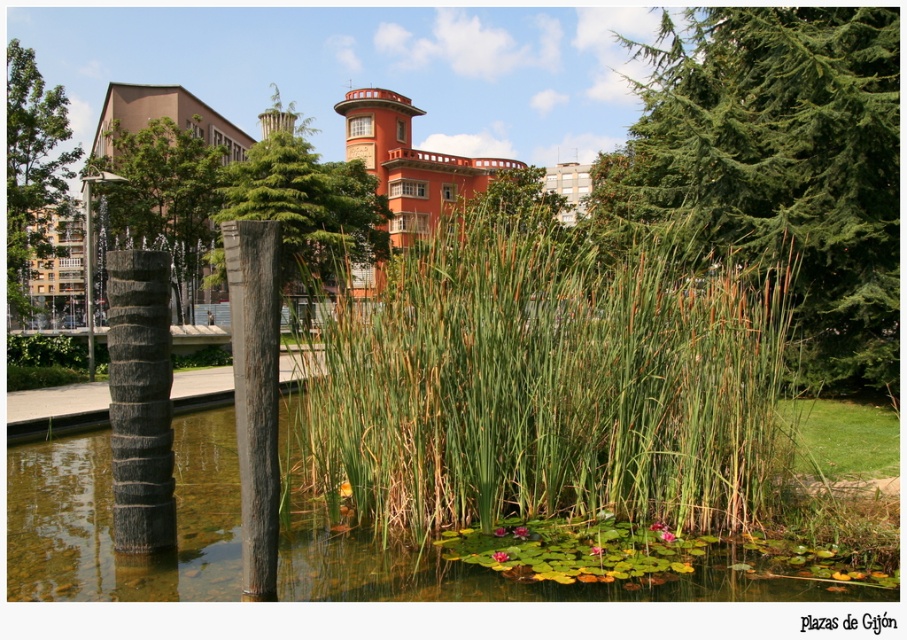
You are standing at the entrance of the park and see both the green leafy tree at center and the smooth gray tree at center. Which tree is positioned to the right when facing the park entrance?

The green leafy tree at center is positioned to the right of the smooth gray tree at center when facing the park entrance.